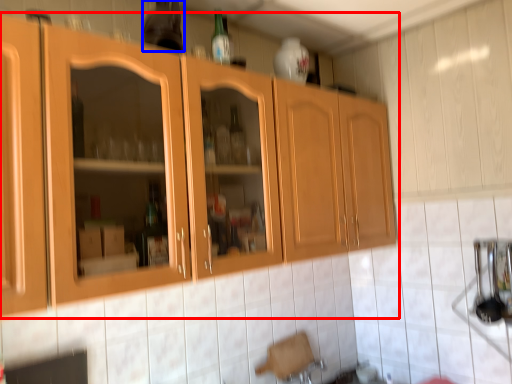
Question: Which point is closer to the camera, cabinetry (highlighted by a red box) or bottle (highlighted by a blue box)?

Choices:
 (A) cabinetry
 (B) bottle

Answer: (A)